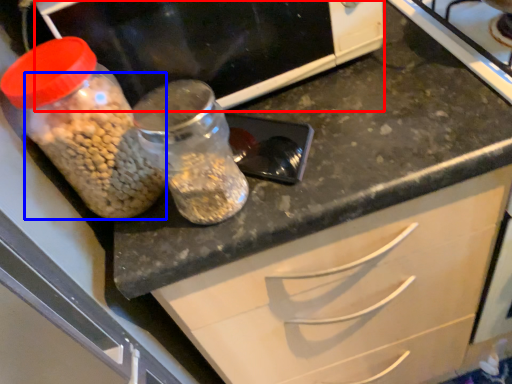
Question: Which object is closer to the camera taking this photo, wide (highlighted by a red box) or food (highlighted by a blue box)?

Choices:
 (A) wide
 (B) food

Answer: (B)